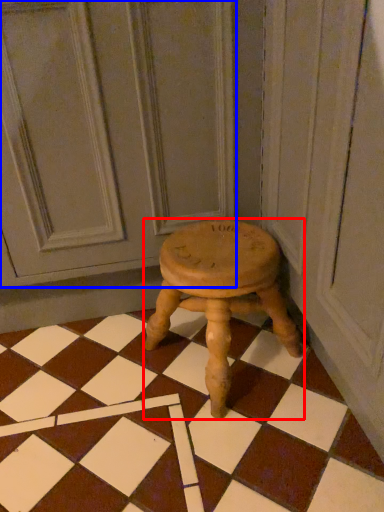
Question: Among these objects, which one is farthest to the camera, stool (highlighted by a red box) or screen door (highlighted by a blue box)?

Choices:
 (A) stool
 (B) screen door

Answer: (A)